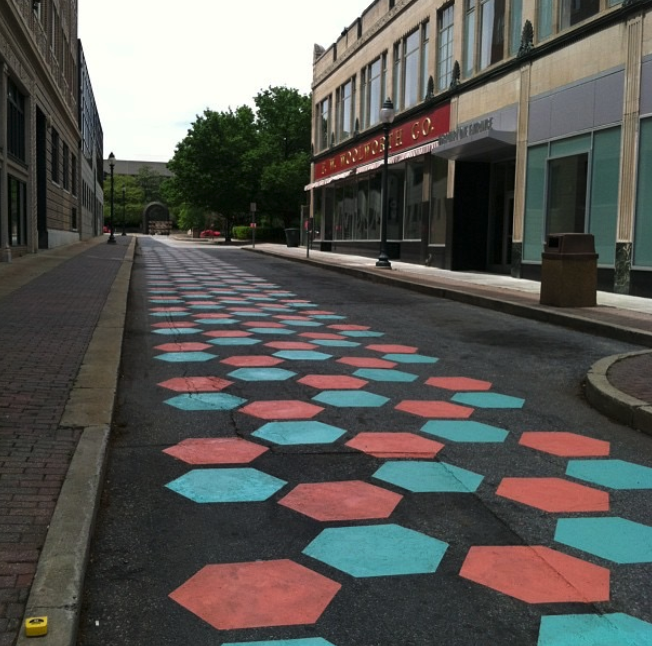
Find the location of a particular element. trashcan is located at coordinates (552, 297), (288, 234).